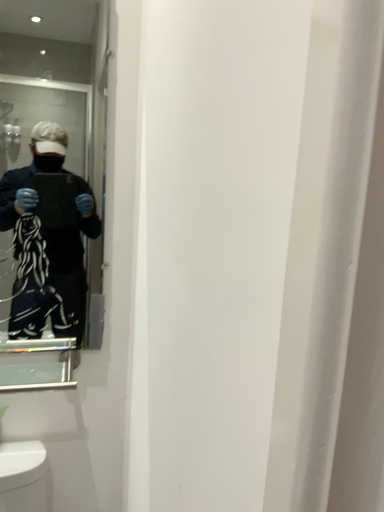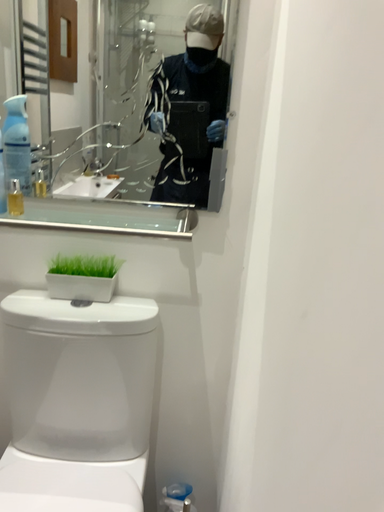
Question: How did the camera likely rotate when shooting the video?

Choices:
 (A) rotated right
 (B) rotated left

Answer: (B)